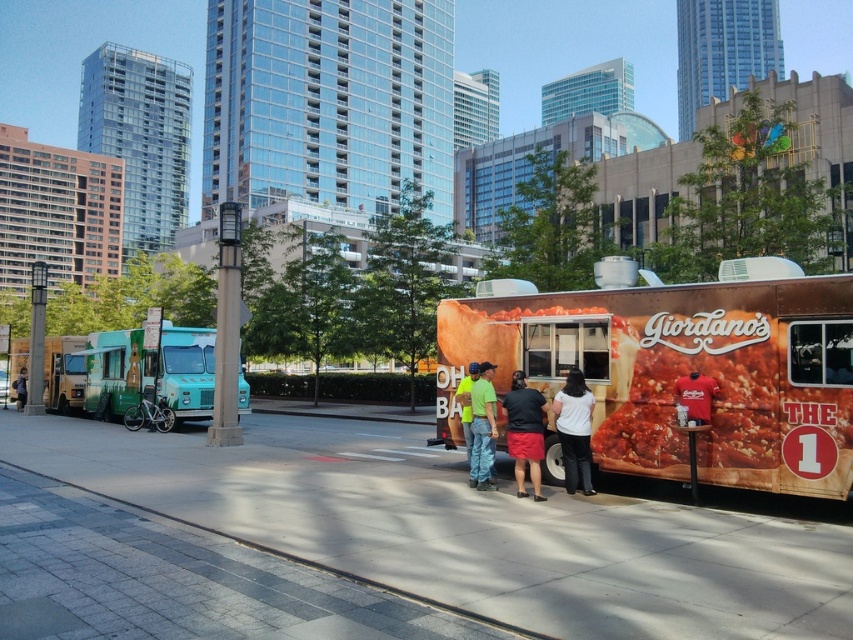
Question: Is matte orange food truck at center to the left of green fabric shirt at center from the viewer's perspective?

Choices:
 (A) yes
 (B) no

Answer: (B)

Question: Can you confirm if matte white food truck at left is positioned to the left of matte black shirt at center?

Choices:
 (A) no
 (B) yes

Answer: (B)

Question: Can you confirm if matte orange food truck at center is thinner than teal matte food truck at left?

Choices:
 (A) yes
 (B) no

Answer: (A)

Question: Which object is positioned farthest from the matte white food truck at left?

Choices:
 (A) gray concrete sidewalk at center
 (B) denim jacket at lower left

Answer: (A)

Question: Which point appears farthest from the camera in this image?

Choices:
 (A) (563, 422)
 (B) (526, 460)
 (C) (469, 385)
 (D) (677, 381)

Answer: (C)

Question: Among these objects, which one is nearest to the camera?

Choices:
 (A) denim jacket at lower left
 (B) green fabric shirt at center
 (C) matte red t-shirt at center
 (D) matte white food truck at left

Answer: (C)